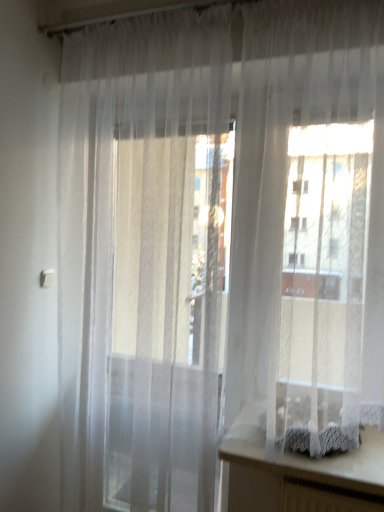
Image resolution: width=384 pixels, height=512 pixels. What do you see at coordinates (297, 473) in the screenshot? I see `white lace vanity at lower right` at bounding box center [297, 473].

The height and width of the screenshot is (512, 384). Identify the location of white lace vanity at lower right. (297, 473).

Locate an element on the screen. This screenshot has width=384, height=512. sheer white curtain at center is located at coordinates (x=309, y=224).

What do you see at coordinates (309, 224) in the screenshot? I see `sheer white curtain at center` at bounding box center [309, 224].

This screenshot has width=384, height=512. I want to click on white lace vanity at lower right, so point(297,473).

Does white lace vanity at lower right appear on the left side of sheer white curtain at center?

In fact, white lace vanity at lower right is to the right of sheer white curtain at center.

Looking at this image, which object is closer to the camera taking this photo, white lace vanity at lower right or sheer white curtain at center?

sheer white curtain at center.

Is point (325, 478) less distant than point (328, 44)?

Yes.

From the image's perspective, which one is positioned lower, white lace vanity at lower right or sheer white curtain at center?

white lace vanity at lower right.

From a real-world perspective, is white lace vanity at lower right below sheer white curtain at center?

Yes, from a real-world perspective, white lace vanity at lower right is under sheer white curtain at center.

Which of these two, white lace vanity at lower right or sheer white curtain at center, is thinner?

sheer white curtain at center is thinner.

In terms of height, does white lace vanity at lower right look taller or shorter compared to sheer white curtain at center?

Considering their sizes, white lace vanity at lower right has less height than sheer white curtain at center.

Considering the relative sizes of white lace vanity at lower right and sheer white curtain at center in the image provided, is white lace vanity at lower right smaller than sheer white curtain at center?

Indeed, white lace vanity at lower right has a smaller size compared to sheer white curtain at center.

Is sheer white curtain at center completely or partially inside white lace vanity at lower right?

No, sheer white curtain at center is located outside of white lace vanity at lower right.

Is white lace vanity at lower right placed right next to sheer white curtain at center?

white lace vanity at lower right is not next to sheer white curtain at center, and they're not touching.

Is white lace vanity at lower right facing towards sheer white curtain at center?

No.

Measure the distance between white lace vanity at lower right and sheer white curtain at center.

17.87 inches.

There is a white lace vanity at lower right. At what (x,y) coordinates should I click in order to perform the action: click on curtain above it (from a real-world perspective). Please return your answer as a coordinate pair (x, y). The height and width of the screenshot is (512, 384). Looking at the image, I should click on (309, 224).

Is sheer white curtain at center at the left side of white lace vanity at lower right?

Correct, you'll find sheer white curtain at center to the left of white lace vanity at lower right.

Is sheer white curtain at center in front of white lace vanity at lower right?

Yes, sheer white curtain at center is closer to the camera.

Is point (253, 103) farther from viewer compared to point (381, 501)?

Yes, point (253, 103) is farther from viewer.

From the image's perspective, is sheer white curtain at center over white lace vanity at lower right?

Yes, from the image's perspective, sheer white curtain at center is over white lace vanity at lower right.

From a real-world perspective, does sheer white curtain at center sit lower than white lace vanity at lower right?

No.

Looking at this image, considering the sizes of objects sheer white curtain at center and white lace vanity at lower right in the image provided, who is thinner, sheer white curtain at center or white lace vanity at lower right?

Thinner between the two is sheer white curtain at center.

Who is taller, sheer white curtain at center or white lace vanity at lower right?

sheer white curtain at center is taller.

Considering the sizes of objects sheer white curtain at center and white lace vanity at lower right in the image provided, who is bigger, sheer white curtain at center or white lace vanity at lower right?

sheer white curtain at center.

Which is correct: sheer white curtain at center is inside white lace vanity at lower right, or outside of it?

sheer white curtain at center is not enclosed by white lace vanity at lower right.

Is sheer white curtain at center in contact with white lace vanity at lower right?

sheer white curtain at center is not next to white lace vanity at lower right, and they're not touching.

From the picture: Is white lace vanity at lower right at the back of sheer white curtain at center?

No, sheer white curtain at center's orientation is not away from white lace vanity at lower right.

How many degrees apart are the facing directions of sheer white curtain at center and white lace vanity at lower right?

0.00354 degrees separate the facing orientations of sheer white curtain at center and white lace vanity at lower right.

Measure the distance from sheer white curtain at center to white lace vanity at lower right.

The distance of sheer white curtain at center from white lace vanity at lower right is 17.87 inches.

The height and width of the screenshot is (512, 384). What are the coordinates of `curtain above the white lace vanity at lower right (from the image's perspective)` in the screenshot? It's located at (309, 224).

This screenshot has height=512, width=384. I want to click on curtain that is above the white lace vanity at lower right (from the image's perspective), so click(x=309, y=224).

The height and width of the screenshot is (512, 384). What are the coordinates of `vanity beneath the sheer white curtain at center (from a real-world perspective)` in the screenshot? It's located at (297, 473).